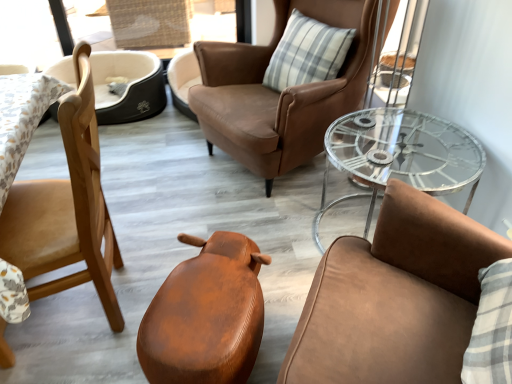
Question: Could you tell me if leather chair at center, arranged as the first chair when viewed from the right, is turned towards light brown wood chair at left, which ranks as the fourth chair in right-to-left order?

Choices:
 (A) yes
 (B) no

Answer: (A)

Question: Is leather chair at center, acting as the 5th chair starting from the left, surrounding light brown wood chair at left, which ranks as the fourth chair in right-to-left order?

Choices:
 (A) yes
 (B) no

Answer: (B)

Question: Considering the relative positions of leather chair at center, arranged as the first chair when viewed from the right, and light brown wood chair at left, acting as the second chair starting from the left, in the image provided, is leather chair at center, arranged as the first chair when viewed from the right, to the right of light brown wood chair at left, acting as the second chair starting from the left, from the viewer's perspective?

Choices:
 (A) yes
 (B) no

Answer: (A)

Question: From the image's perspective, is leather chair at center, arranged as the first chair when viewed from the right, over light brown wood chair at left, which ranks as the fourth chair in right-to-left order?

Choices:
 (A) yes
 (B) no

Answer: (B)

Question: Is leather chair at center, arranged as the first chair when viewed from the right, thinner than light brown wood chair at left, acting as the second chair starting from the left?

Choices:
 (A) yes
 (B) no

Answer: (B)

Question: Considering the positions of plaid fabric pillow at center and leather-like brown stool at center, the third chair in the left-to-right sequence, in the image, is plaid fabric pillow at center wider or thinner than leather-like brown stool at center, the third chair in the left-to-right sequence,?

Choices:
 (A) wide
 (B) thin

Answer: (B)

Question: Is plaid fabric pillow at center taller or shorter than leather-like brown stool at center, acting as the third chair starting from the right?

Choices:
 (A) short
 (B) tall

Answer: (B)

Question: In the image, is plaid fabric pillow at center positioned in front of or behind leather-like brown stool at center, acting as the third chair starting from the right?

Choices:
 (A) front
 (B) behind

Answer: (B)

Question: Considering the positions of point (272, 59) and point (245, 251), is point (272, 59) closer or farther from the camera than point (245, 251)?

Choices:
 (A) farther
 (B) closer

Answer: (A)

Question: Would you say wooden chair at left, marked as the first chair in a left-to-right arrangement, is inside or outside leather chair at center, acting as the 5th chair starting from the left?

Choices:
 (A) inside
 (B) outside

Answer: (B)

Question: Considering the positions of wooden chair at left, marked as the first chair in a left-to-right arrangement, and leather chair at center, acting as the 5th chair starting from the left, in the image, is wooden chair at left, marked as the first chair in a left-to-right arrangement, taller or shorter than leather chair at center, acting as the 5th chair starting from the left,?

Choices:
 (A) tall
 (B) short

Answer: (B)

Question: Is wooden chair at left, marked as the first chair in a left-to-right arrangement, bigger or smaller than leather chair at center, arranged as the first chair when viewed from the right?

Choices:
 (A) big
 (B) small

Answer: (B)

Question: Considering the positions of point (138, 107) and point (409, 226), is point (138, 107) closer or farther from the camera than point (409, 226)?

Choices:
 (A) farther
 (B) closer

Answer: (A)

Question: Is plaid fabric pillow at center in front of or behind light brown wood chair at left, acting as the second chair starting from the left, in the image?

Choices:
 (A) front
 (B) behind

Answer: (B)

Question: Considering the positions of plaid fabric pillow at center and light brown wood chair at left, which ranks as the fourth chair in right-to-left order, in the image, is plaid fabric pillow at center wider or thinner than light brown wood chair at left, which ranks as the fourth chair in right-to-left order,?

Choices:
 (A) wide
 (B) thin

Answer: (B)